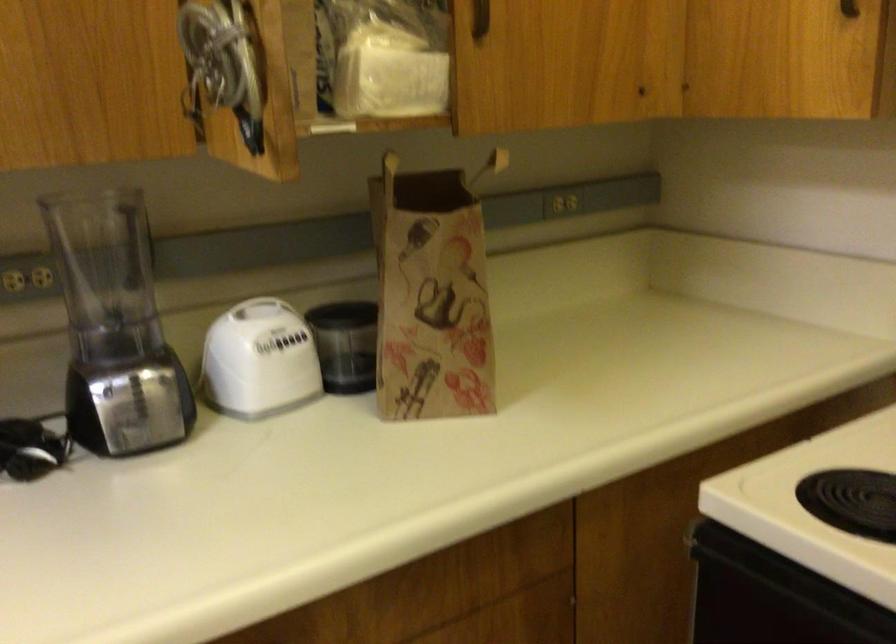
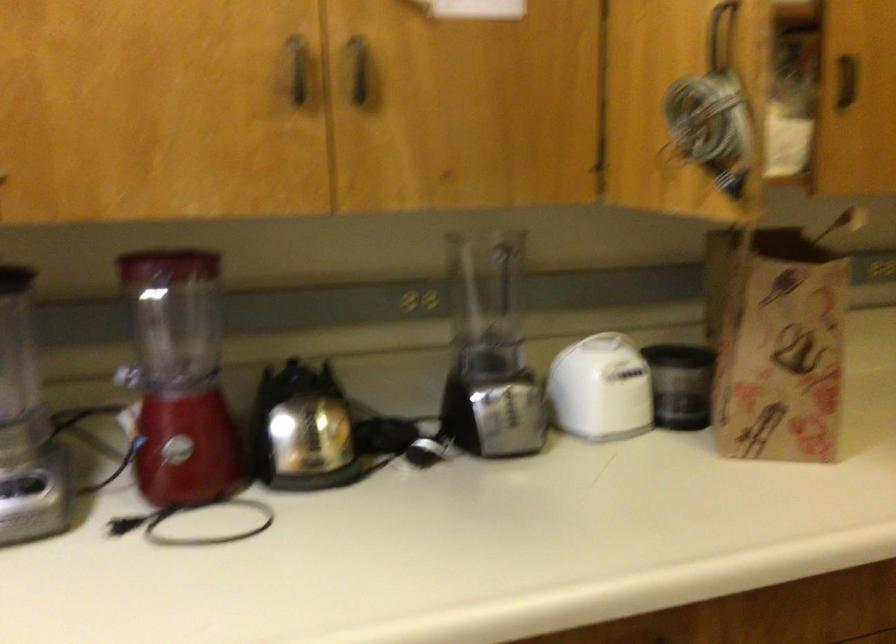
The point at (x=113, y=337) is marked in the first image. Where is the corresponding point in the second image?

(489, 351)